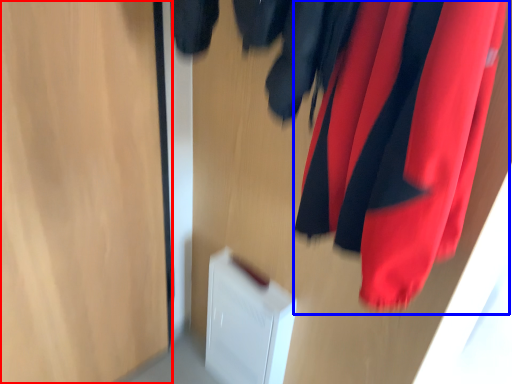
Question: Which point is closer to the camera, glass door (highlighted by a red box) or curtain (highlighted by a blue box)?

Choices:
 (A) glass door
 (B) curtain

Answer: (B)